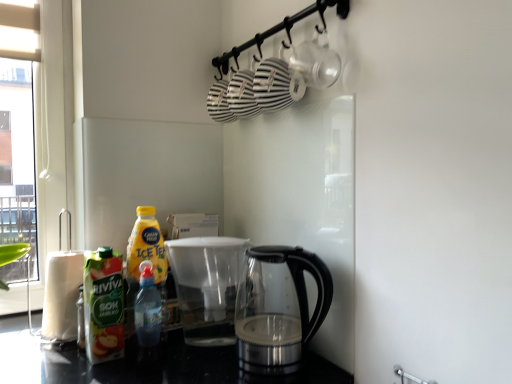
Question: Looking at their shapes, would you say translucent plastic bottle at lower left, positioned as the 2th bottle in left-to-right order, is wider or thinner than green matte juice at left, the 1th bottle viewed from the left?

Choices:
 (A) wide
 (B) thin

Answer: (B)

Question: Is translucent plastic bottle at lower left, which appears as the first bottle when viewed from the right, bigger or smaller than green matte juice at left, which is the 2th bottle from right to left?

Choices:
 (A) small
 (B) big

Answer: (A)

Question: Which object is positioned farthest from the green matte juice at left, the 1th bottle viewed from the left?

Choices:
 (A) transparent glass kettle at lower center
 (B) translucent plastic bottle at lower left, which appears as the first bottle when viewed from the right
 (C) white paper towel at left

Answer: (A)

Question: Estimate the real-world distances between objects in this image. Which object is farther from the white paper towel at left?

Choices:
 (A) translucent plastic bottle at lower left, which appears as the first bottle when viewed from the right
 (B) transparent glass kettle at lower center
 (C) green matte juice at left, which is the 2th bottle from right to left

Answer: (B)